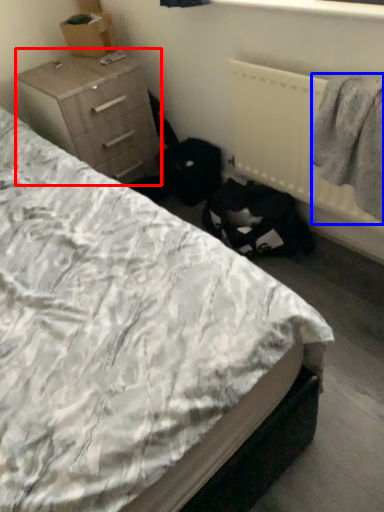
Question: Which point is further to the camera, chest of drawers (highlighted by a red box) or clothing (highlighted by a blue box)?

Choices:
 (A) chest of drawers
 (B) clothing

Answer: (A)